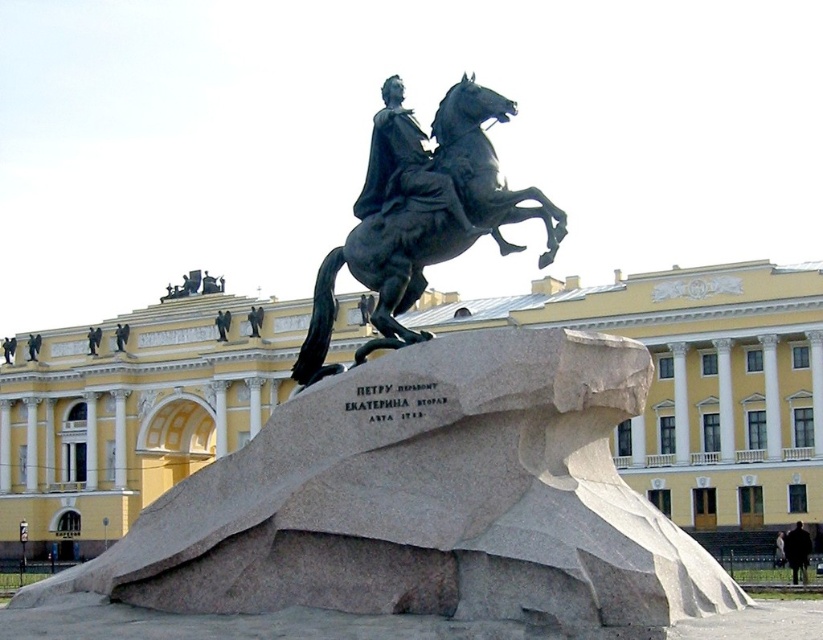
Question: Which object is farther from the camera taking this photo?

Choices:
 (A) polished bronze horse at center
 (B) polished bronze statue at center

Answer: (B)

Question: Which object is farther from the camera taking this photo?

Choices:
 (A) polished bronze horse at center
 (B) polished bronze statue at center

Answer: (B)

Question: In this image, where is polished bronze horse at center located relative to polished bronze statue at center?

Choices:
 (A) right
 (B) left

Answer: (B)

Question: Is polished bronze horse at center closer to the viewer compared to polished bronze statue at center?

Choices:
 (A) no
 (B) yes

Answer: (B)

Question: Can you confirm if polished bronze horse at center is wider than polished bronze statue at center?

Choices:
 (A) no
 (B) yes

Answer: (B)